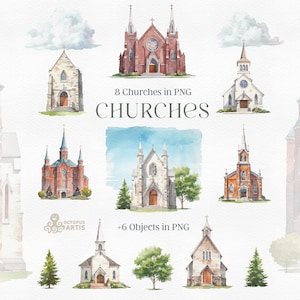
This screenshot has width=300, height=300. I want to click on front door, so click(x=99, y=277), click(x=206, y=274), click(x=243, y=194), click(x=243, y=104), click(x=65, y=98), click(x=63, y=195), click(x=153, y=198), click(x=152, y=66).